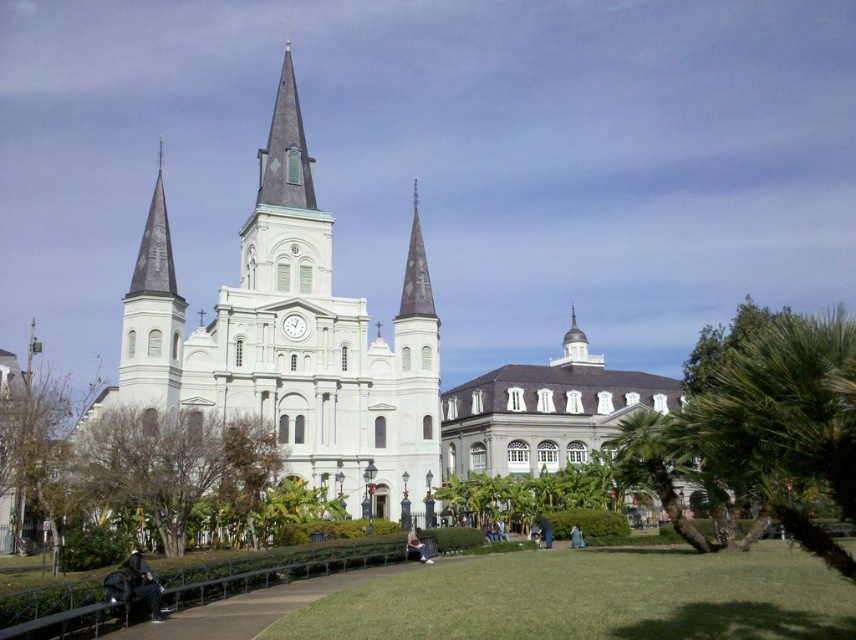
Question: Which of the following is the closest to the observer?

Choices:
 (A) (697, 609)
 (B) (155, 605)
 (C) (301, 332)

Answer: (A)

Question: Observing the image, what is the correct spatial positioning of green grass at center in reference to blue jeans at lower right?

Choices:
 (A) right
 (B) left

Answer: (A)

Question: Does dark blue jeans at lower left appear on the left side of light brown leather jacket at lower center?

Choices:
 (A) yes
 (B) no

Answer: (A)

Question: Which object appears closest to the camera in this image?

Choices:
 (A) dark blue jeans at lower left
 (B) white stone church at center
 (C) light brown leather jacket at lower center

Answer: (A)

Question: Can you confirm if white glossy clock at center is positioned below blue jeans at lower right?

Choices:
 (A) yes
 (B) no

Answer: (B)

Question: Which object is positioned closest to the light brown leather jacket at lower center?

Choices:
 (A) white stone church at center
 (B) green grass at center
 (C) white glossy clock at center

Answer: (B)